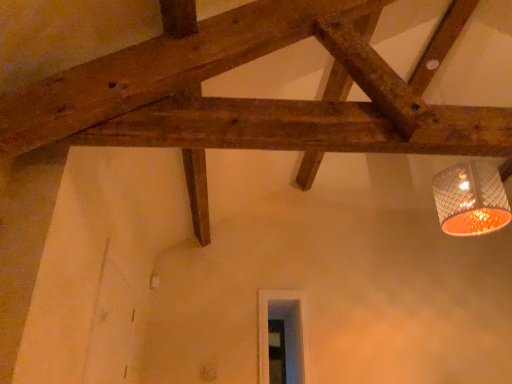
Find the location of a particular element. This screenshot has width=512, height=384. white glossy window at lower center is located at coordinates (285, 333).

Describe the element at coordinates (285, 333) in the screenshot. This screenshot has height=384, width=512. I see `white glossy window at lower center` at that location.

At what (x,y) coordinates should I click in order to perform the action: click on white glossy window at lower center. Please return your answer as a coordinate pair (x, y). This screenshot has height=384, width=512. Looking at the image, I should click on (285, 333).